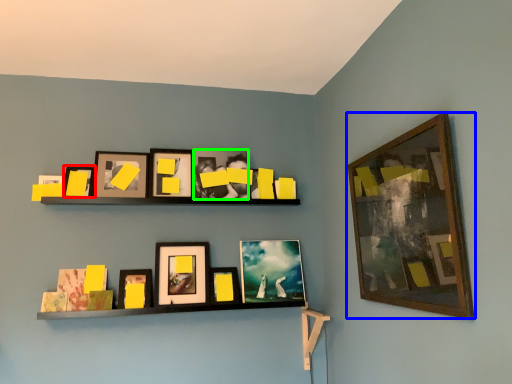
Question: Based on their relative distances, which object is farther from picture frame (highlighted by a red box)? Choose from picture frame (highlighted by a blue box) and picture frame (highlighted by a green box).

Choices:
 (A) picture frame
 (B) picture frame

Answer: (A)